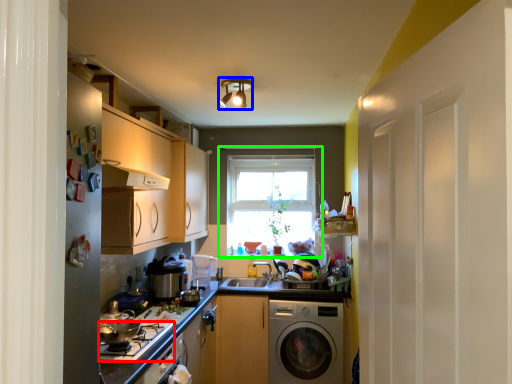
Question: Which object is positioned farthest from gas stove (highlighted by a red box)? Select from light fixture (highlighted by a blue box) and window (highlighted by a green box).

Choices:
 (A) light fixture
 (B) window

Answer: (B)